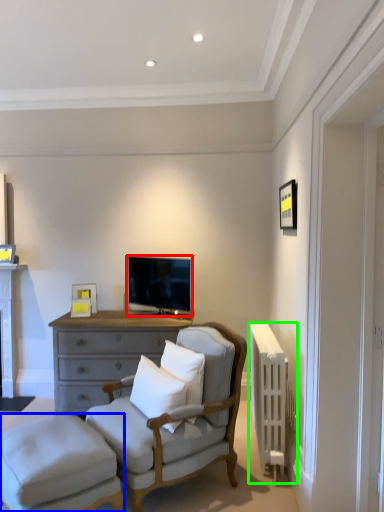
Question: Estimate the real-world distances between objects in this image. Which object is farther from television (highlighted by a red box), stool (highlighted by a blue box) or radiator (highlighted by a green box)?

Choices:
 (A) stool
 (B) radiator

Answer: (A)